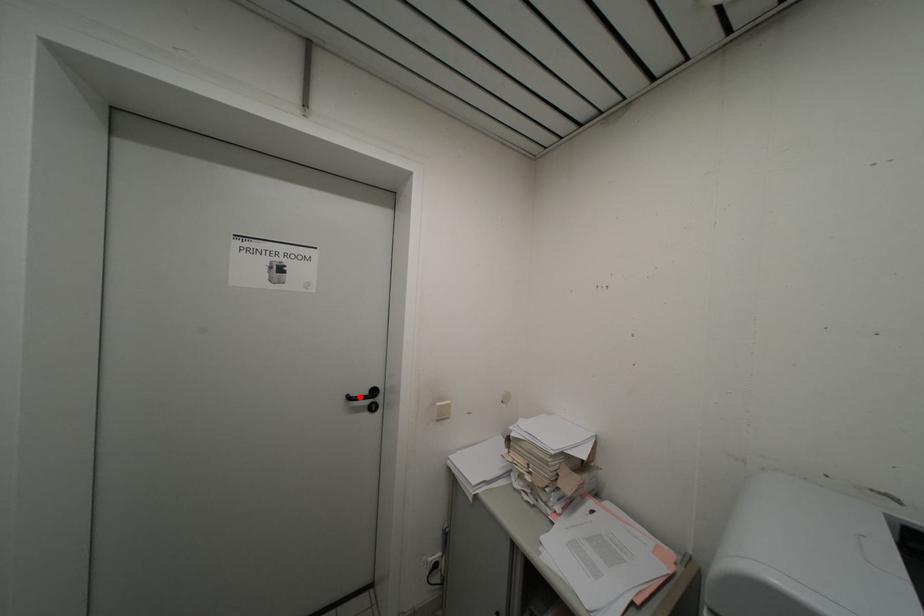
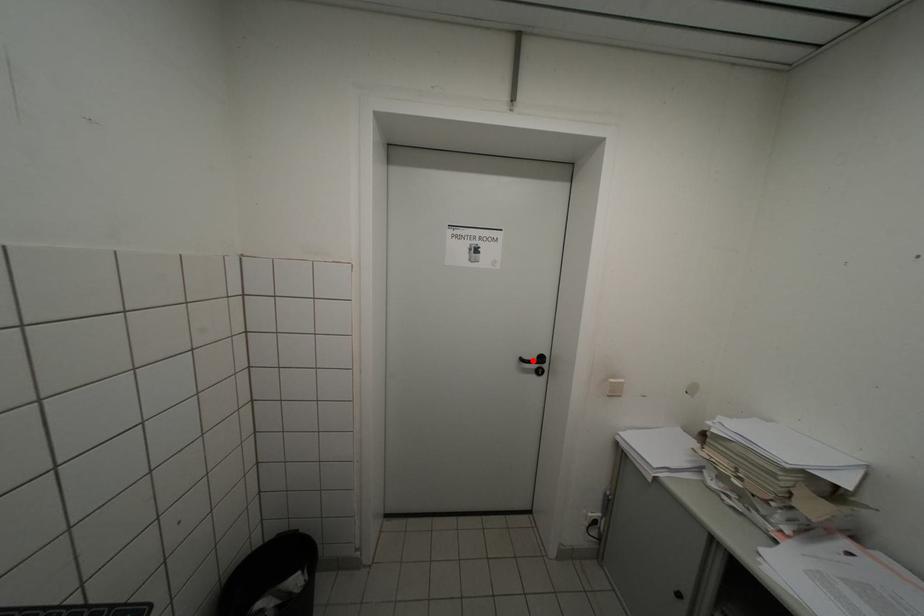
I am providing you with two images of the same scene from different viewpoints. A red point is marked on the first image and another point is marked on the second image. Are the points marked in image1 and image2 representing the same 3D position?

Yes